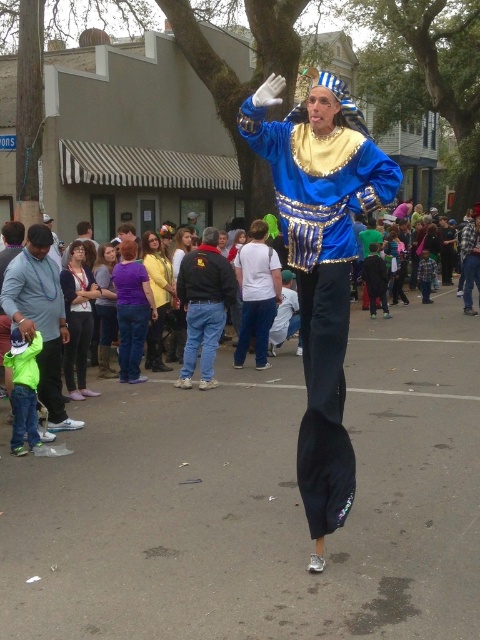
You are a photographer at the event and want to capture both the black denim jacket at center and the purple cotton shirt at center in the same frame. The camera you are using has a maximum focus range of 20 inches. Can you include both items in your shot without moving the camera?

The black denim jacket at center is 22.64 inches from the purple cotton shirt at center, which exceeds the camera maximum focus range of 20 inches. Therefore, you cannot include both items in the same frame without moving the camera.

You are a photographer trying to capture a group photo of the two people wearing the black denim jacket at center and the purple cotton shirt at center. Since you want to ensure both are fully visible, which person should you position closer to the camera to avoid cropping?

The black denim jacket at center is wider than the purple cotton shirt at center, so positioning the person wearing the black denim jacket at center closer to the camera will ensure their full width is captured without cropping.

You are a photographer trying to capture a photo of both the black denim jacket at center and the purple cotton shirt at center. Which clothing item should you focus on first if you want to ensure both are clearly visible in the frame?

You should focus on the black denim jacket at center first because it is bigger than the purple cotton shirt at center, so ensuring it is in focus will help both items be visible.